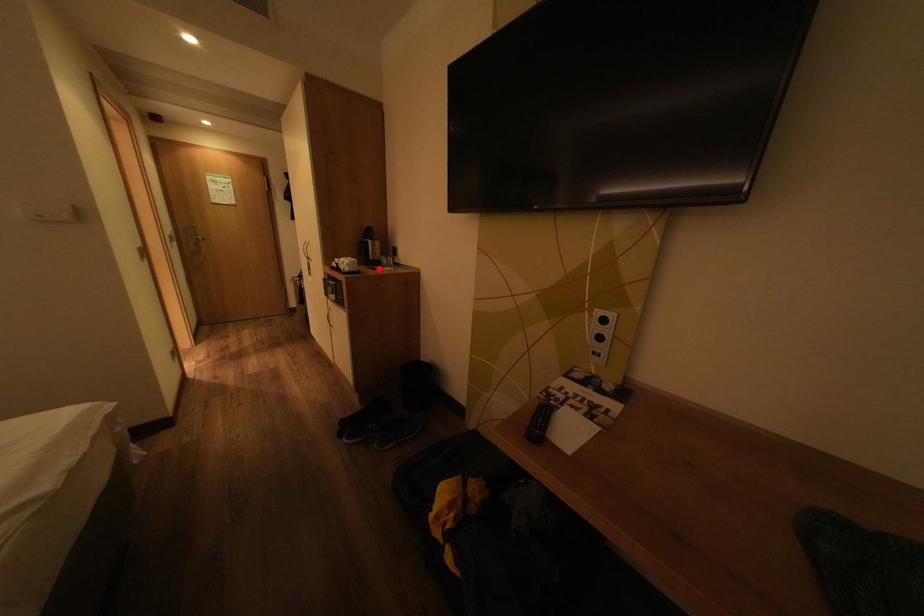
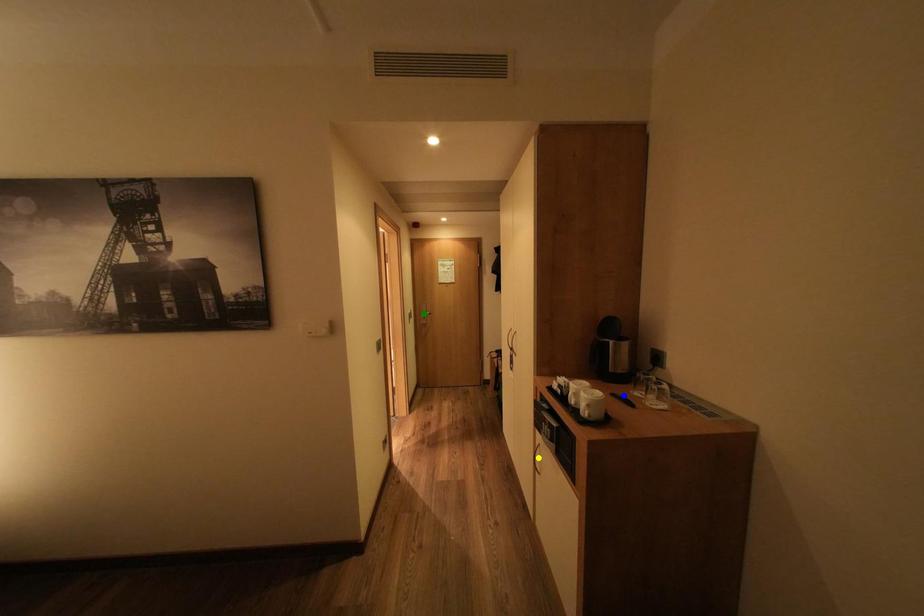
Question: I am providing you with two images of the same scene from different viewpoints. A red point is marked on the first image. You are given multiple points on the second image. Which point in image 2 represents the same 3d spot as the red point in image 1?

Choices:
 (A) green point
 (B) yellow point
 (C) blue point

Answer: (C)